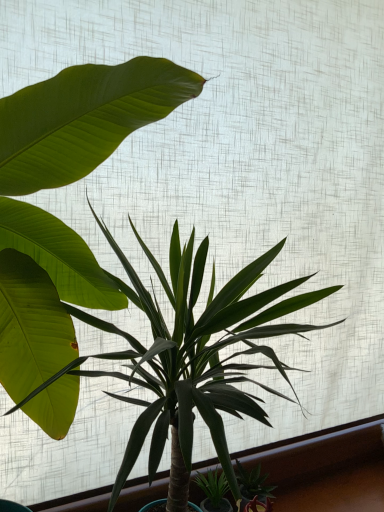
Question: From the image's perspective, relative to green glossy plant at center, which ranks as the second houseplant in bottom-to-top order, is green glossy succulent at lower right, positioned as the second houseplant in top-to-bottom order, above or below?

Choices:
 (A) below
 (B) above

Answer: (A)

Question: Based on their sizes in the image, would you say green glossy succulent at lower right, arranged as the first houseplant when ordered from the bottom, is bigger or smaller than green glossy plant at center, arranged as the first houseplant when viewed from the left?

Choices:
 (A) small
 (B) big

Answer: (A)

Question: From a real-world perspective, is green glossy succulent at lower right, arranged as the second houseplant when viewed from the left, above or below green glossy plant at center, arranged as the first houseplant when viewed from the left?

Choices:
 (A) below
 (B) above

Answer: (A)

Question: Does point (231, 389) appear closer or farther from the camera than point (248, 482)?

Choices:
 (A) closer
 (B) farther

Answer: (A)

Question: From the image's perspective, is green glossy plant at center, arranged as the first houseplant when viewed from the left, positioned above or below green glossy succulent at lower right, positioned as the second houseplant in top-to-bottom order?

Choices:
 (A) above
 (B) below

Answer: (A)

Question: Is green glossy plant at center, which ranks as the second houseplant in bottom-to-top order, spatially inside green glossy succulent at lower right, arranged as the second houseplant when viewed from the left, or outside of it?

Choices:
 (A) outside
 (B) inside

Answer: (A)

Question: Considering the positions of green glossy plant at center, arranged as the first houseplant when viewed from the left, and green glossy succulent at lower right, which ranks as the 1th houseplant in right-to-left order, in the image, is green glossy plant at center, arranged as the first houseplant when viewed from the left, wider or thinner than green glossy succulent at lower right, which ranks as the 1th houseplant in right-to-left order,?

Choices:
 (A) wide
 (B) thin

Answer: (A)